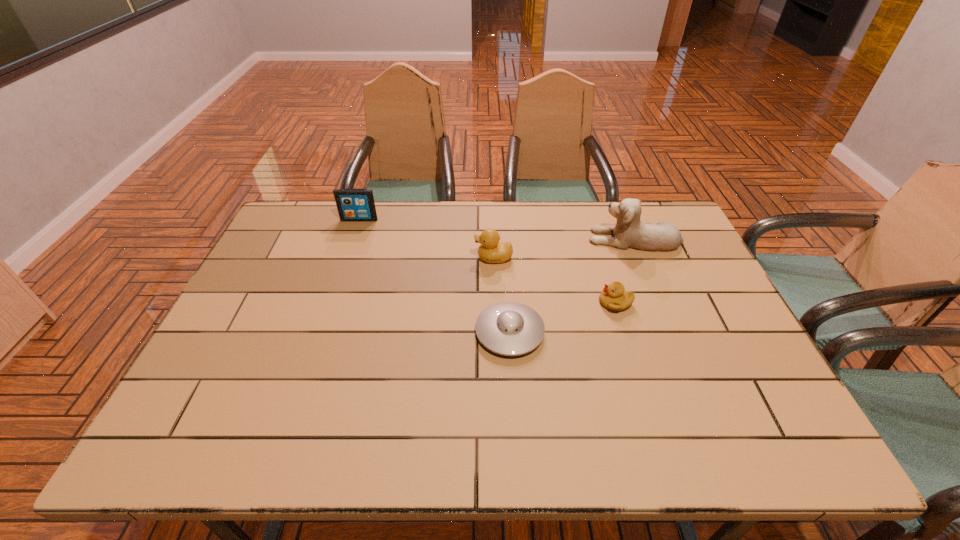
Locate an element on the screen. iPod positioned at the far edge is located at coordinates (353, 204).

What are the coordinates of `object that is at the right edge` in the screenshot? It's located at click(x=629, y=232).

At what (x,y) coordinates should I click in order to perform the action: click on object that is at the far right corner. Please return your answer as a coordinate pair (x, y). The width and height of the screenshot is (960, 540). Looking at the image, I should click on (629, 232).

Image resolution: width=960 pixels, height=540 pixels. In the image, there is a desktop. In order to click on vacant space at the near edge in this screenshot , I will do `click(550, 427)`.

At what (x,y) coordinates should I click in order to perform the action: click on vacant space at the left edge of the desktop. Please return your answer as a coordinate pair (x, y). This screenshot has height=540, width=960. Looking at the image, I should click on (276, 321).

In the image, there is a desktop. Where is `free space at the right edge`? The image size is (960, 540). free space at the right edge is located at coordinates (748, 404).

This screenshot has height=540, width=960. In the image, there is a desktop. What are the coordinates of `free region at the far left corner` in the screenshot? It's located at (318, 208).

I want to click on vacant area at the near left corner, so coord(178,444).

In the image, there is a desktop. Where is `vacant space at the near right corner`? This screenshot has height=540, width=960. vacant space at the near right corner is located at coordinates click(x=732, y=423).

Locate an element on the screen. This screenshot has width=960, height=540. free point between the saucer and the farther duckling is located at coordinates (502, 295).